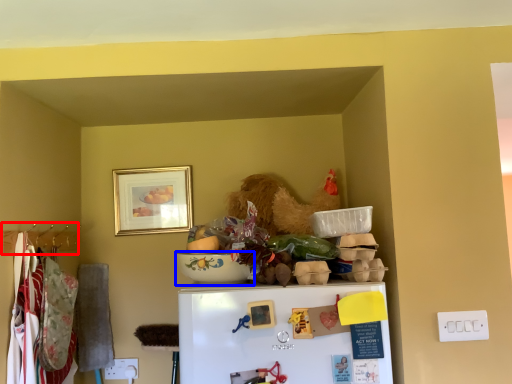
Question: Which object is further to the camera taking this photo, hanger (highlighted by a red box) or bowl (highlighted by a blue box)?

Choices:
 (A) hanger
 (B) bowl

Answer: (A)